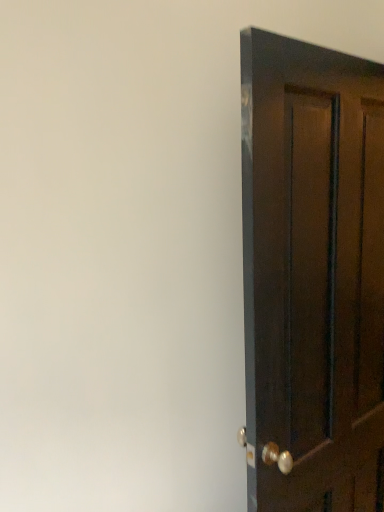
What do you see at coordinates (312, 276) in the screenshot? The width and height of the screenshot is (384, 512). I see `dark wood door at right` at bounding box center [312, 276].

Locate an element on the screen. This screenshot has height=512, width=384. dark wood door at right is located at coordinates (312, 276).

Find the location of a particular element. dark wood door at right is located at coordinates (312, 276).